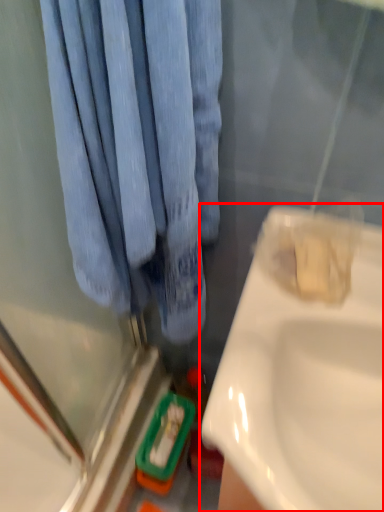
Question: Where is sink (annotated by the red box) located in relation to curtain in the image?

Choices:
 (A) left
 (B) right

Answer: (B)